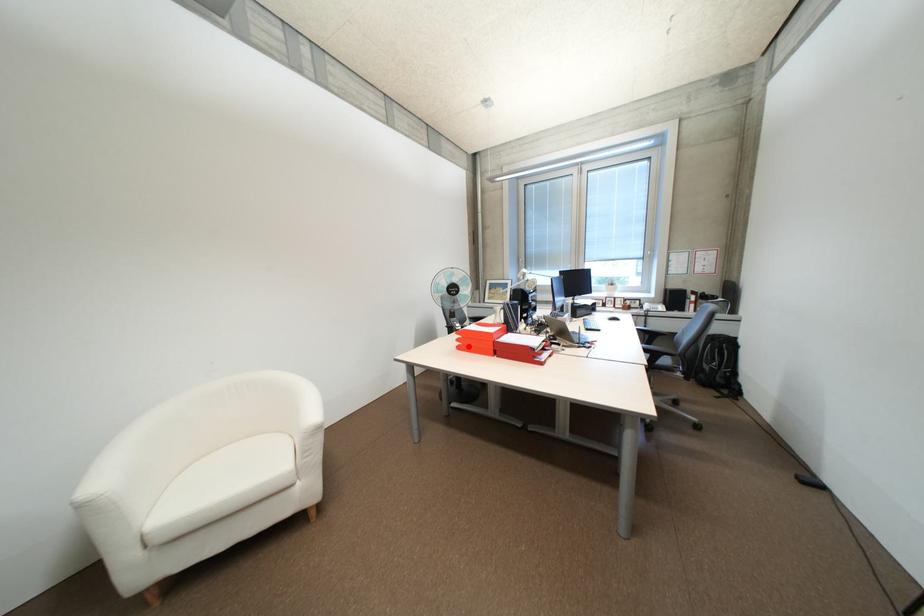
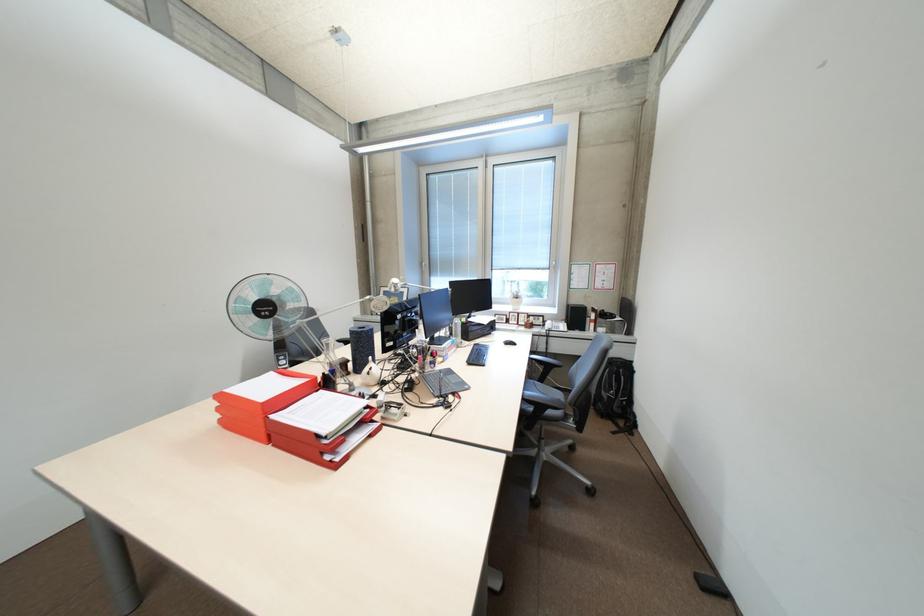
Where in the second image is the point corresponding to the highlighted location from the first image?

(231, 421)